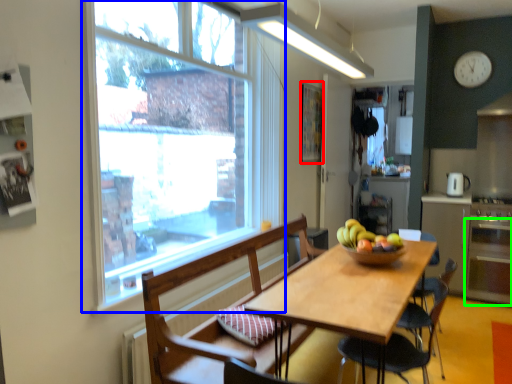
Question: Based on their relative distances, which object is nearer to bulletin board (highlighted by a red box)? Choose from window (highlighted by a blue box) and oven (highlighted by a green box).

Choices:
 (A) window
 (B) oven

Answer: (A)